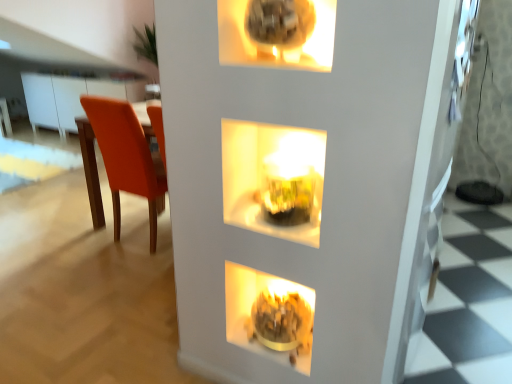
Question: From a real-world perspective, is translucent glass vase at center located beneath matte gold bowl at lower center?

Choices:
 (A) yes
 (B) no

Answer: (B)

Question: Does translucent glass vase at center have a lesser width compared to matte gold bowl at lower center?

Choices:
 (A) yes
 (B) no

Answer: (B)

Question: Is the position of translucent glass vase at center more distant than that of matte gold bowl at lower center?

Choices:
 (A) no
 (B) yes

Answer: (A)

Question: Is translucent glass vase at center facing towards matte gold bowl at lower center?

Choices:
 (A) yes
 (B) no

Answer: (B)

Question: Is translucent glass vase at center turned away from matte gold bowl at lower center?

Choices:
 (A) no
 (B) yes

Answer: (A)

Question: Does translucent glass vase at center have a smaller size compared to matte gold bowl at lower center?

Choices:
 (A) no
 (B) yes

Answer: (A)

Question: From a real-world perspective, is matte gold bowl at lower center positioned under translucent glass vase at center based on gravity?

Choices:
 (A) yes
 (B) no

Answer: (A)

Question: From the image's perspective, is matte gold bowl at lower center beneath translucent glass vase at center?

Choices:
 (A) no
 (B) yes

Answer: (B)

Question: From a real-world perspective, does matte gold bowl at lower center stand above translucent glass vase at center?

Choices:
 (A) yes
 (B) no

Answer: (B)

Question: Considering the relative positions of matte gold bowl at lower center and translucent glass vase at center in the image provided, is matte gold bowl at lower center to the left of translucent glass vase at center from the viewer's perspective?

Choices:
 (A) yes
 (B) no

Answer: (A)

Question: Is matte gold bowl at lower center to the right of translucent glass vase at center from the viewer's perspective?

Choices:
 (A) no
 (B) yes

Answer: (A)

Question: Can you confirm if matte gold bowl at lower center is taller than translucent glass vase at center?

Choices:
 (A) no
 (B) yes

Answer: (A)

Question: Is orange matte chair at left closer to the viewer compared to translucent glass vase at center?

Choices:
 (A) no
 (B) yes

Answer: (A)